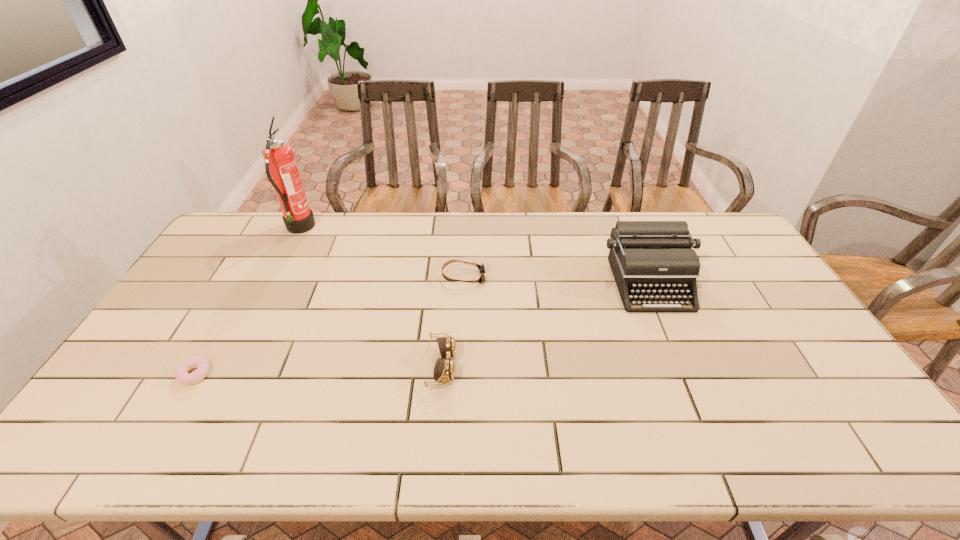
This screenshot has width=960, height=540. Identify the location of blank region between the shorter goggles and the tallest object. (381, 253).

This screenshot has width=960, height=540. Find the location of `vacant area that lies between the typewriter and the fourth tallest object`. vacant area that lies between the typewriter and the fourth tallest object is located at coordinates (557, 280).

I want to click on free space between the second shortest object and the shortest object, so click(x=329, y=326).

Where is `vacant space in between the fourth shortest object and the nearer goggles`? vacant space in between the fourth shortest object and the nearer goggles is located at coordinates (546, 325).

Locate an element on the screen. free space between the rightmost object and the fire extinguisher is located at coordinates (475, 256).

Identify the location of free space between the typewriter and the farthest object. (475, 256).

Find the location of `vacant space that is in between the typewriter and the doughnut`. vacant space that is in between the typewriter and the doughnut is located at coordinates (422, 329).

This screenshot has height=540, width=960. I want to click on unoccupied area between the fourth shortest object and the taller goggles, so click(x=546, y=325).

Image resolution: width=960 pixels, height=540 pixels. Identify the location of free point between the shortest object and the second shortest object. (329, 326).

Locate which object ranks in proximity to the doughnut. Please provide its 2D coordinates. Your answer should be formatted as a tuple, i.e. [(x, y)], where the tuple contains the x and y coordinates of a point satisfying the conditions above.

[(281, 168)]